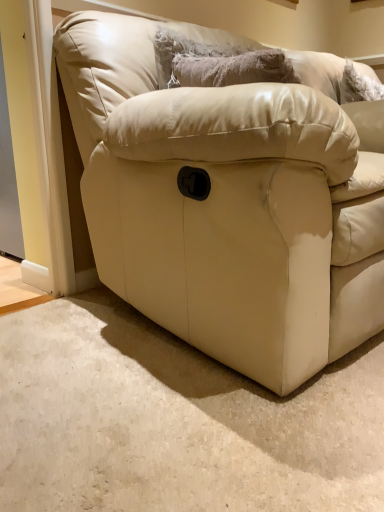
What do you see at coordinates (215, 63) in the screenshot?
I see `fuzzy gray pillow at upper center` at bounding box center [215, 63].

You are a GUI agent. You are given a task and a screenshot of the screen. Output one action in this format:
    pyautogui.click(x=<x>, y=<y>)
    Task: Click on the fuzzy gray pillow at upper center
    
    Given the screenshot: What is the action you would take?
    pyautogui.click(x=215, y=63)

This screenshot has height=512, width=384. Find the location of `matte leather couch at center`. matte leather couch at center is located at coordinates (229, 199).

The image size is (384, 512). What do you see at coordinates (229, 199) in the screenshot?
I see `matte leather couch at center` at bounding box center [229, 199].

Where is `fuzzy gray pillow at upper center`? This screenshot has height=512, width=384. fuzzy gray pillow at upper center is located at coordinates (215, 63).

Between fuzzy gray pillow at upper center and matte leather couch at center, which one appears on the left side from the viewer's perspective?

Positioned to the left is fuzzy gray pillow at upper center.

Is fuzzy gray pillow at upper center positioned behind matte leather couch at center?

Yes, the depth of fuzzy gray pillow at upper center is greater than that of matte leather couch at center.

Does point (183, 64) appear closer or farther from the camera than point (380, 298)?

Clearly, point (183, 64) is more distant from the camera than point (380, 298).

From the image's perspective, is fuzzy gray pillow at upper center above matte leather couch at center?

Yes, from the image's perspective, fuzzy gray pillow at upper center is above matte leather couch at center.

From a real-world perspective, is fuzzy gray pillow at upper center on top of matte leather couch at center?

Correct, in the physical world, fuzzy gray pillow at upper center is higher than matte leather couch at center.

Considering the sizes of objects fuzzy gray pillow at upper center and matte leather couch at center in the image provided, who is wider, fuzzy gray pillow at upper center or matte leather couch at center?

With larger width is matte leather couch at center.

Between fuzzy gray pillow at upper center and matte leather couch at center, which one has more height?

matte leather couch at center is taller.

Which of these two, fuzzy gray pillow at upper center or matte leather couch at center, is smaller?

fuzzy gray pillow at upper center.

Is fuzzy gray pillow at upper center situated inside matte leather couch at center or outside?

fuzzy gray pillow at upper center is located inside matte leather couch at center.

Is fuzzy gray pillow at upper center not close to matte leather couch at center?

They are positioned close to each other.

Is fuzzy gray pillow at upper center turned away from matte leather couch at center?

Yes, matte leather couch at center is at the back of fuzzy gray pillow at upper center.

The width and height of the screenshot is (384, 512). In order to click on pillow that is on the left side of matte leather couch at center in this screenshot , I will do `click(215, 63)`.

Between matte leather couch at center and fuzzy gray pillow at upper center, which one appears on the left side from the viewer's perspective?

fuzzy gray pillow at upper center.

Does matte leather couch at center come behind fuzzy gray pillow at upper center?

No.

Considering the points (378, 259) and (164, 72), which point is behind, point (378, 259) or point (164, 72)?

The point (164, 72) is behind.

From the image's perspective, is matte leather couch at center located above or below fuzzy gray pillow at upper center?

Clearly, from the image's perspective, matte leather couch at center is below fuzzy gray pillow at upper center.

From a real-world perspective, is matte leather couch at center physically below fuzzy gray pillow at upper center?

Yes, from a real-world perspective, matte leather couch at center is below fuzzy gray pillow at upper center.

Between matte leather couch at center and fuzzy gray pillow at upper center, which one has smaller width?

Thinner between the two is fuzzy gray pillow at upper center.

Is matte leather couch at center shorter than fuzzy gray pillow at upper center?

No.

Who is bigger, matte leather couch at center or fuzzy gray pillow at upper center?

matte leather couch at center is bigger.

Is fuzzy gray pillow at upper center a part of matte leather couch at center?

Yes, fuzzy gray pillow at upper center is a part of matte leather couch at center.

Would you consider matte leather couch at center to be distant from fuzzy gray pillow at upper center?

No, there isn't a large distance between matte leather couch at center and fuzzy gray pillow at upper center.

Is matte leather couch at center oriented away from fuzzy gray pillow at upper center?

That's right, matte leather couch at center is facing away from fuzzy gray pillow at upper center.

How different are the orientations of matte leather couch at center and fuzzy gray pillow at upper center in degrees?

The facing directions of matte leather couch at center and fuzzy gray pillow at upper center are 2.78 degrees apart.

From the picture: How far apart are matte leather couch at center and fuzzy gray pillow at upper center?

The distance of matte leather couch at center from fuzzy gray pillow at upper center is 11.23 inches.

This screenshot has height=512, width=384. Identify the location of pillow above the matte leather couch at center (from a real-world perspective). (215, 63).

Locate an element on the screen. This screenshot has width=384, height=512. studio couch lying in front of the fuzzy gray pillow at upper center is located at coordinates (229, 199).

Find the location of a particular element. This screenshot has height=512, width=384. studio couch below the fuzzy gray pillow at upper center (from a real-world perspective) is located at coordinates (229, 199).